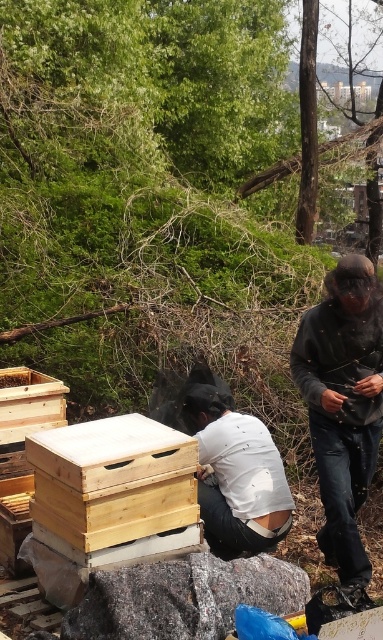
You are a beekeeper trying to reach the light brown wooden beehive at center while avoiding getting too close to the white matte shirt at center. Can you safely approach the hive without coming near the shirt?

The light brown wooden beehive at center is closer to the viewer than the white matte shirt at center, so you can safely approach the hive without coming near the shirt.

You are planning to carry both the dark gray fleece jacket at right and the light brown wooden beehive at center. Which item can you carry without needing a wider carrying strap?

The dark gray fleece jacket at right has a smaller width than the light brown wooden beehive at center, so you can carry it without needing a wider carrying strap.